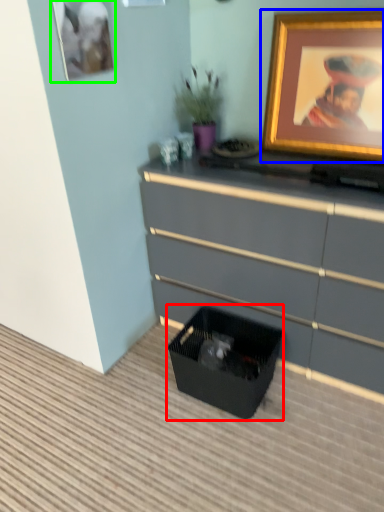
Question: Considering the real-world distances, which object is farthest from storage box (highlighted by a red box)? picture frame (highlighted by a blue box) or picture frame (highlighted by a green box)?

Choices:
 (A) picture frame
 (B) picture frame

Answer: (B)